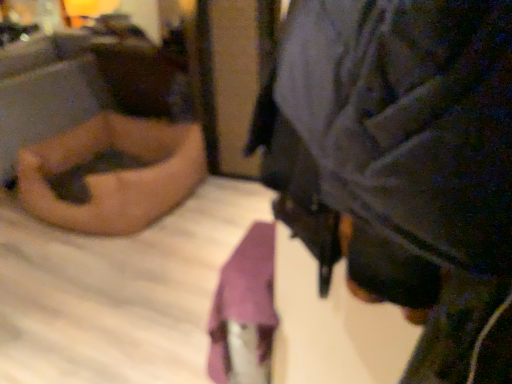
Question: Based on their positions, is velvet-like black jacket at center, which appears as the second person when viewed from the back, located to the left or right of matte black laptop at left, marked as the second person in a front-to-back arrangement?

Choices:
 (A) right
 (B) left

Answer: (A)

Question: Looking at their shapes, would you say velvet-like black jacket at center, acting as the 1th person starting from the front, is wider or thinner than matte black laptop at left, positioned as the 1th person in back-to-front order?

Choices:
 (A) wide
 (B) thin

Answer: (B)

Question: Considering their positions, is velvet-like black jacket at center, acting as the 1th person starting from the front, located in front of or behind matte black laptop at left, the 1th person when ordered from left to right?

Choices:
 (A) behind
 (B) front

Answer: (B)

Question: From a real-world perspective, is matte black laptop at left, the 1th person when ordered from left to right, positioned above or below velvet-like black jacket at center, acting as the 1th person starting from the front?

Choices:
 (A) above
 (B) below

Answer: (B)

Question: Is point (56, 218) positioned closer to the camera than point (352, 82)?

Choices:
 (A) closer
 (B) farther

Answer: (B)

Question: Considering the positions of matte black laptop at left, positioned as the 1th person in back-to-front order, and velvet-like black jacket at center, placed as the 2th person when sorted from left to right, in the image, is matte black laptop at left, positioned as the 1th person in back-to-front order, taller or shorter than velvet-like black jacket at center, placed as the 2th person when sorted from left to right,?

Choices:
 (A) tall
 (B) short

Answer: (A)

Question: Is matte black laptop at left, positioned as the 1th person in back-to-front order, inside or outside of velvet-like black jacket at center, acting as the 1th person starting from the front?

Choices:
 (A) inside
 (B) outside

Answer: (B)